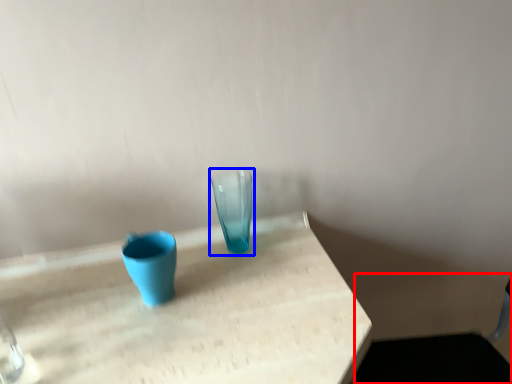
Question: Which object appears closest to the camera in this image, swivel chair (highlighted by a red box) or vase (highlighted by a blue box)?

Choices:
 (A) swivel chair
 (B) vase

Answer: (A)